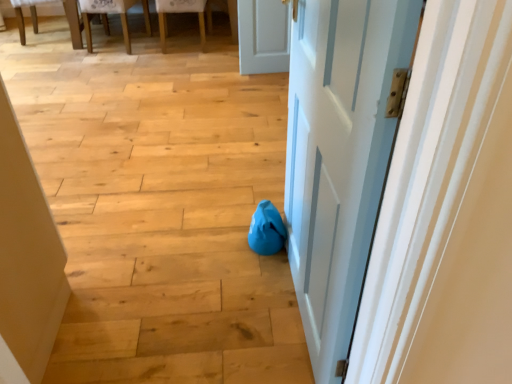
Where is `vacant area that lies between wooden chair at upper left, the 1th chair from the right, and white painted wood door at center`? This screenshot has width=512, height=384. vacant area that lies between wooden chair at upper left, the 1th chair from the right, and white painted wood door at center is located at coordinates (215, 115).